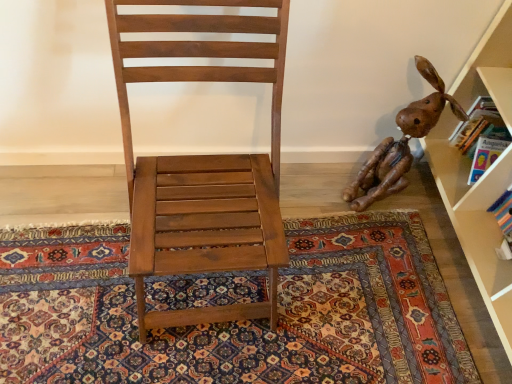
The image size is (512, 384). Find the location of `free space to the right of brown leather dog at right`. free space to the right of brown leather dog at right is located at coordinates (431, 210).